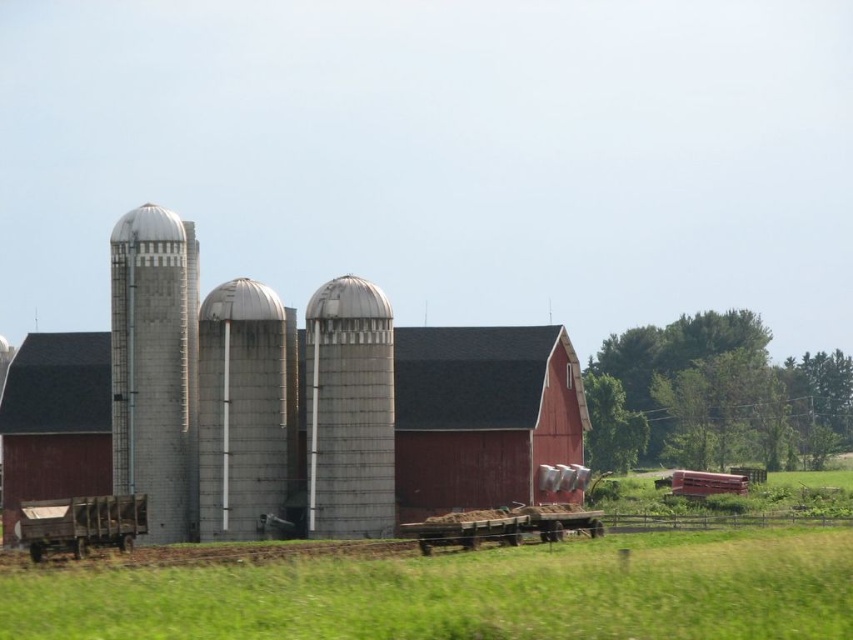
Question: Can you confirm if wooden wagon at lower left is wider than brown wooden wagon at lower center?

Choices:
 (A) no
 (B) yes

Answer: (B)

Question: Which point is farther from the camera taking this photo?

Choices:
 (A) (222, 512)
 (B) (106, 385)

Answer: (B)

Question: Estimate the real-world distances between objects in this image. Which object is closer to the green grass at lower center?

Choices:
 (A) gray concrete silo at left
 (B) wooden wagon at lower left

Answer: (B)

Question: Does green grass at lower center appear on the right side of red painted wood barn at center?

Choices:
 (A) no
 (B) yes

Answer: (B)

Question: Observing the image, what is the correct spatial positioning of green grass at lower center in reference to gray concrete silo at left?

Choices:
 (A) left
 (B) right

Answer: (B)

Question: Which object is positioned farthest from the sanded concrete silo at center?

Choices:
 (A) brown wooden wagon at lower center
 (B) smooth wooden wagon at lower right

Answer: (B)